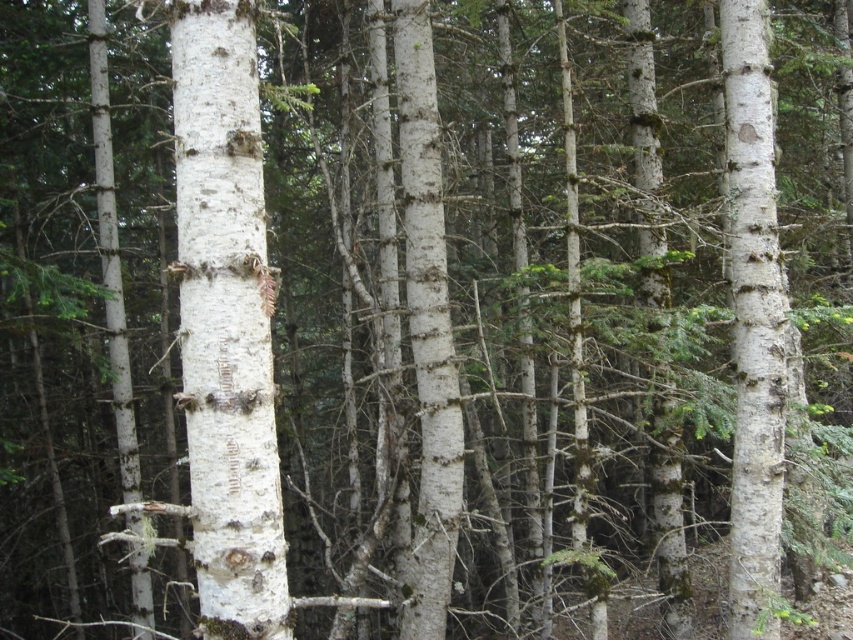
Is white bark tree trunk at center wider than smooth white tree trunk at right?

No.

Who is more distant from viewer, [265,528] or [734,102]?

Point [734,102]

Between point (242, 131) and point (743, 58), which one is positioned in front?

Point (242, 131) is in front.

Locate an element on the screen. The height and width of the screenshot is (640, 853). white bark tree trunk at center is located at coordinates (225, 323).